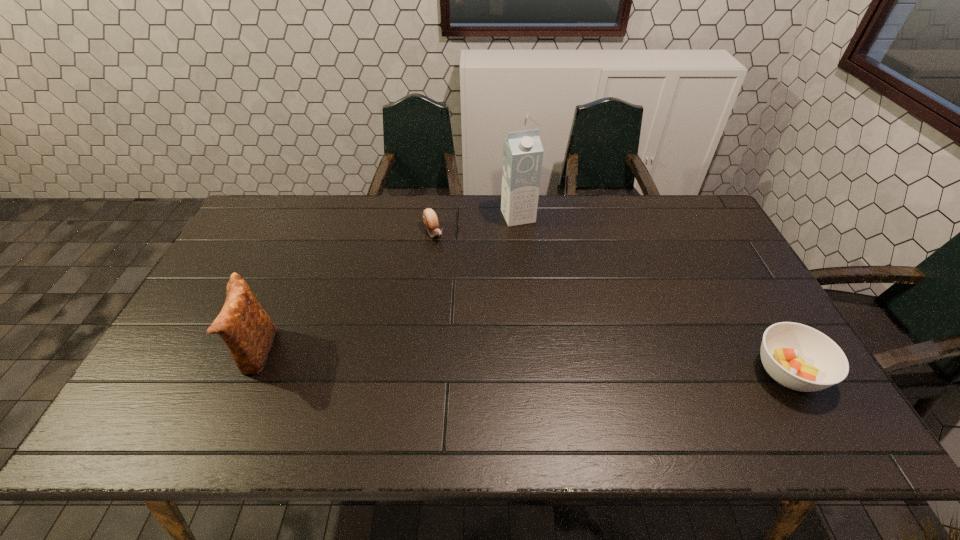
This screenshot has height=540, width=960. I want to click on empty space between the soup bowl and the escargot, so click(x=611, y=302).

This screenshot has height=540, width=960. I want to click on blank region between the carton and the clutch bag, so click(387, 285).

Identify the location of free space between the third object from left to right and the leftmost object. This screenshot has height=540, width=960. (387, 285).

The width and height of the screenshot is (960, 540). I want to click on empty location between the carton and the soup bowl, so click(x=653, y=294).

What are the coordinates of `vacant space in between the rightmost object and the third object from right to left` in the screenshot? It's located at (611, 302).

Identify the location of free spot between the third object from left to right and the escargot. (476, 225).

Find the location of a particular element. This screenshot has width=960, height=540. unoccupied area between the second object from right to left and the rightmost object is located at coordinates (653, 294).

This screenshot has width=960, height=540. Find the location of `unoccupied area between the leftmost object and the soup bowl`. unoccupied area between the leftmost object and the soup bowl is located at coordinates (522, 363).

This screenshot has height=540, width=960. In order to click on free area in between the tallest object and the third object from right to left in this screenshot , I will do `click(476, 225)`.

This screenshot has width=960, height=540. Find the location of `free space between the rightmost object and the escargot`. free space between the rightmost object and the escargot is located at coordinates (611, 302).